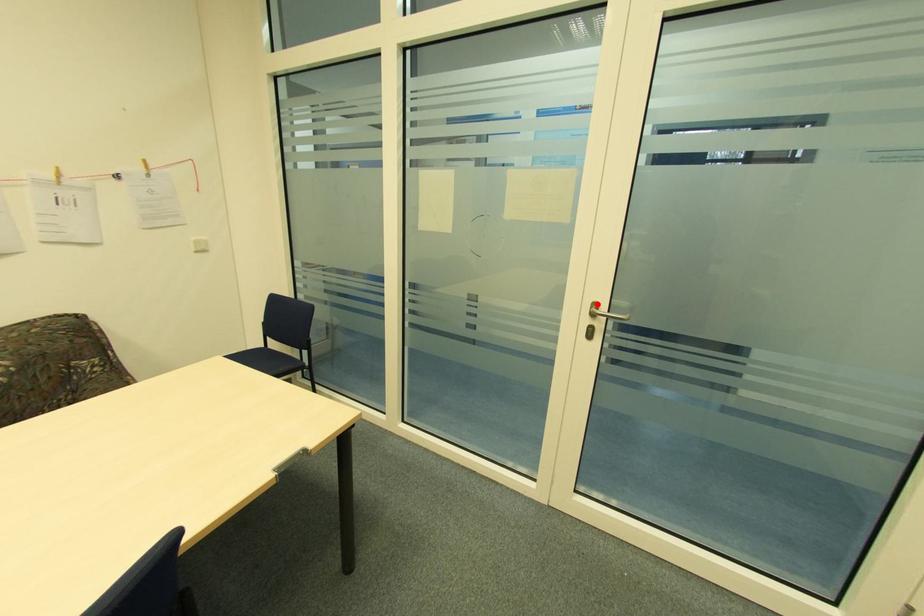
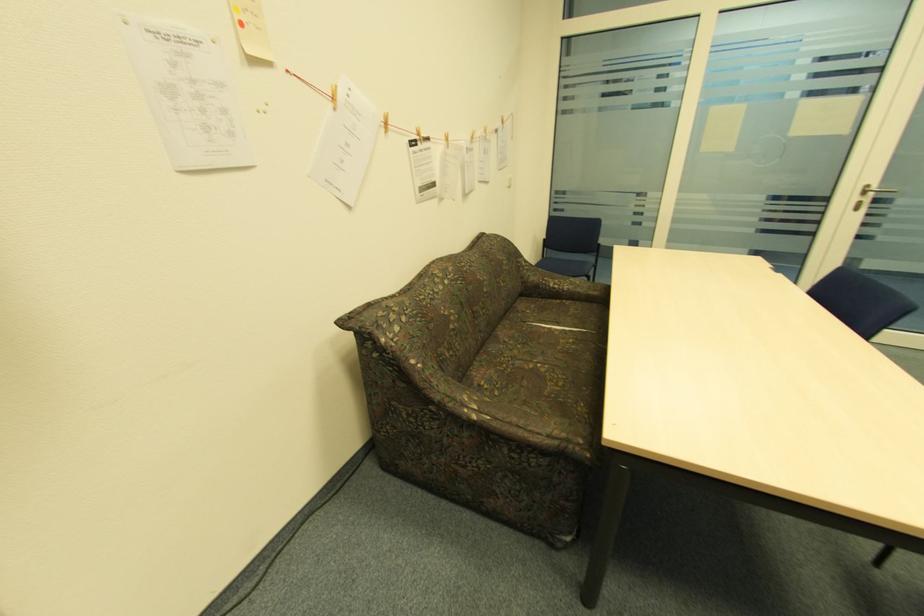
Find the pixel in the second image that matches the highlighted location in the first image.

(870, 187)